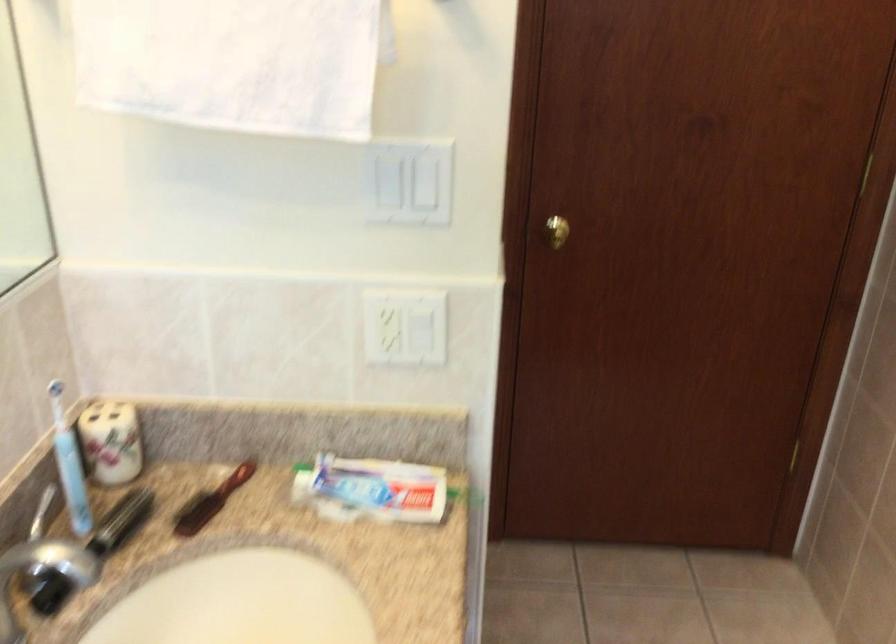
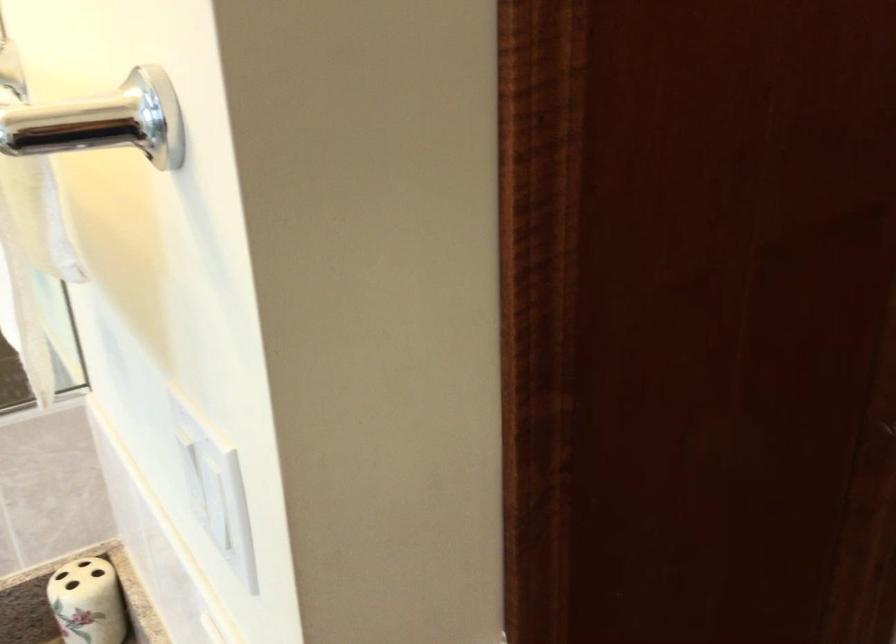
Question: The images are taken continuously from a first-person perspective. In which direction is your viewpoint rotating?

Choices:
 (A) Left
 (B) Right
 (C) Up
 (D) Down

Answer: (A)